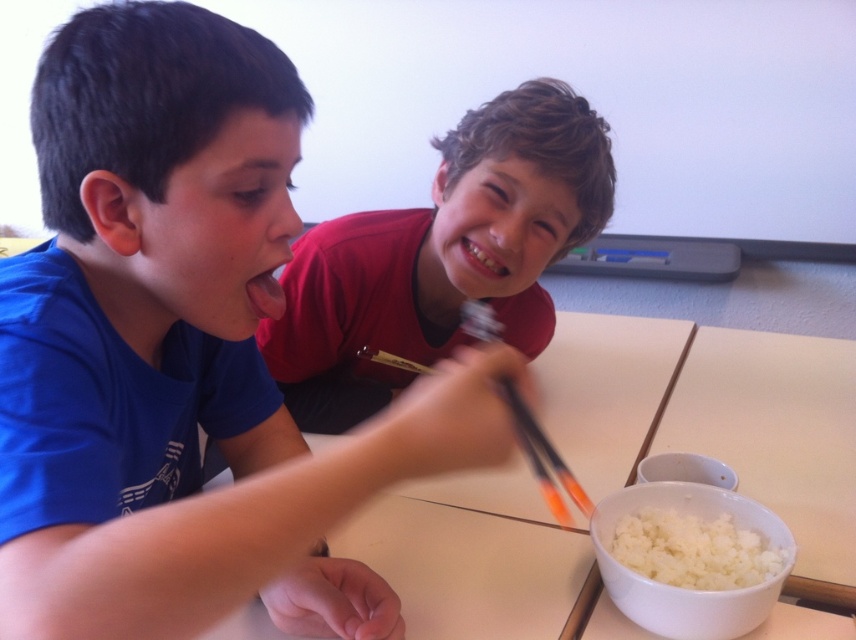
Looking at this image, you are a photographer positioned behind the two children at the table. You want to focus your camera on the white matte table at center and the red matte shirt at upper center. Which object should you adjust the focus on first to ensure both are in sharp view?

The white matte table at center is closer to the viewer than the red matte shirt at upper center, so you should focus on the white matte table at center first to ensure both are in sharp view.

You are a parent observing your children at the table. You want to place a small plate between the white matte table at center and the red matte shirt at upper center. Which object should the plate be closer to?

The white matte table at center is shorter than the red matte shirt at upper center, so the plate should be placed closer to the white matte table at center to ensure stability.